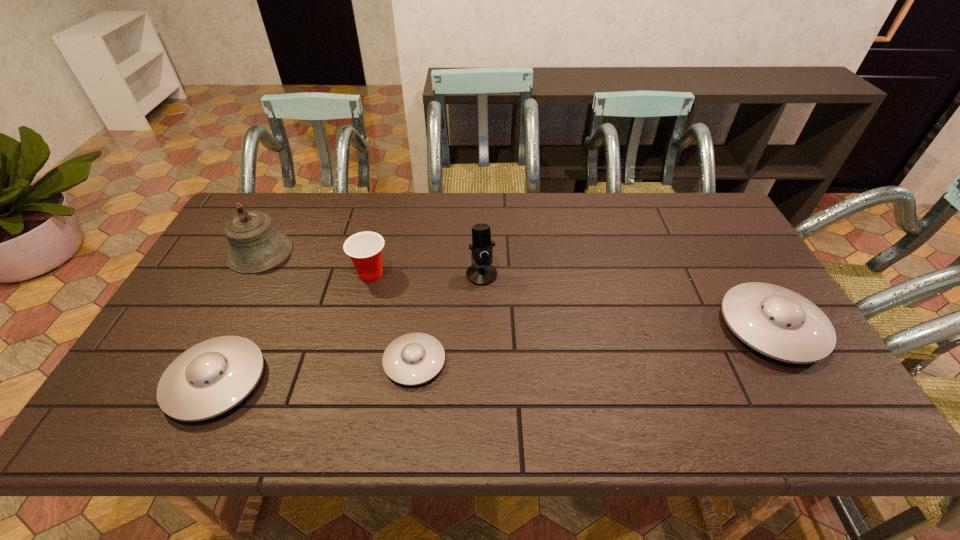
This screenshot has width=960, height=540. Find the location of `free spot that satisfies the following two spatial constraints: 1. on the front side of the rightmost saucer; 2. on the left side of the bell`. free spot that satisfies the following two spatial constraints: 1. on the front side of the rightmost saucer; 2. on the left side of the bell is located at coordinates (221, 327).

Where is `blank area in the image that satisfies the following two spatial constraints: 1. on the stand of the rightmost object; 2. on the left side of the microphone`? Image resolution: width=960 pixels, height=540 pixels. blank area in the image that satisfies the following two spatial constraints: 1. on the stand of the rightmost object; 2. on the left side of the microphone is located at coordinates (482, 327).